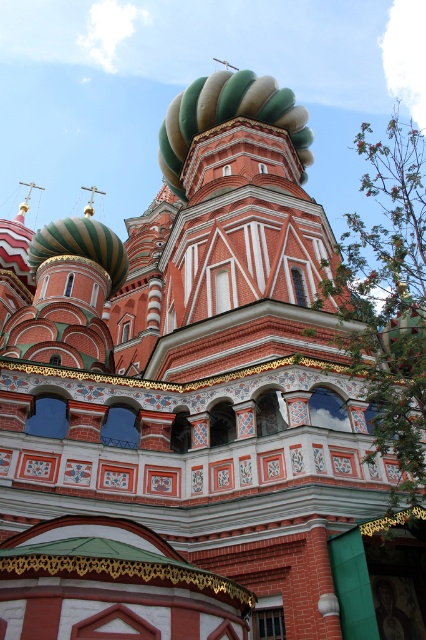
Question: Does green glossy onion dome at center appear on the left side of green striped dome at upper left?

Choices:
 (A) yes
 (B) no

Answer: (B)

Question: Which point is closer to the camera?

Choices:
 (A) (31, 250)
 (B) (233, 113)

Answer: (A)

Question: Is green glossy onion dome at center positioned in front of green striped dome at upper left?

Choices:
 (A) yes
 (B) no

Answer: (B)

Question: Is green glossy onion dome at center thinner than green striped dome at upper left?

Choices:
 (A) no
 (B) yes

Answer: (A)

Question: Which of the following is the farthest from the observer?

Choices:
 (A) green glossy onion dome at center
 (B) green striped dome at upper left

Answer: (A)